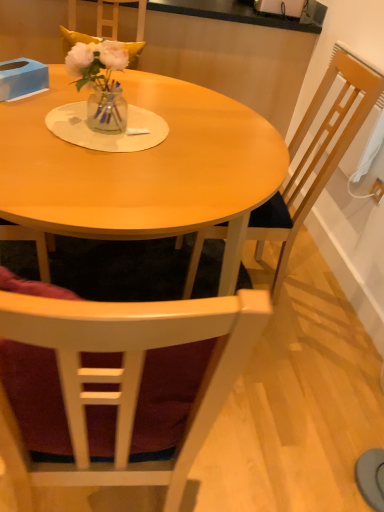
Find the location of `free location to the right of translucent glass vase at center`. free location to the right of translucent glass vase at center is located at coordinates (161, 134).